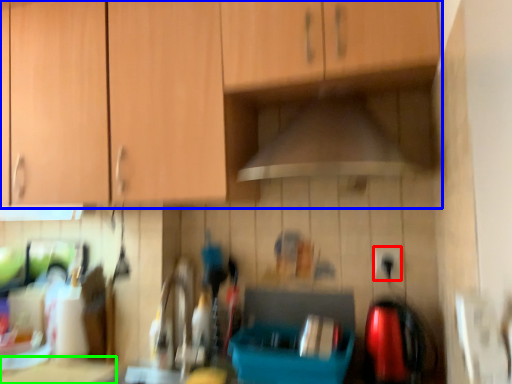
Question: Which is nearer to the electric outlet (highlighted by a red box)? cabinetry (highlighted by a blue box) or counter top (highlighted by a green box).

Choices:
 (A) cabinetry
 (B) counter top

Answer: (A)